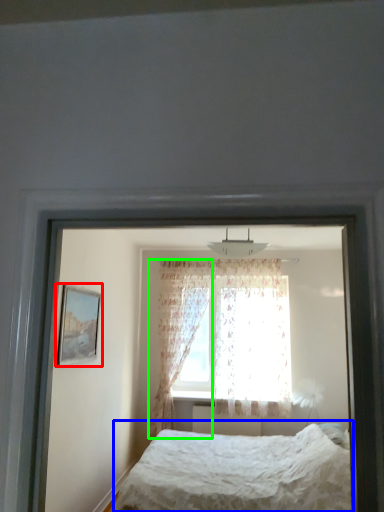
Question: Which object is the closest to the picture frame (highlighted by a red box)? Choose among these: bed (highlighted by a blue box) or curtain (highlighted by a green box).

Choices:
 (A) bed
 (B) curtain

Answer: (A)